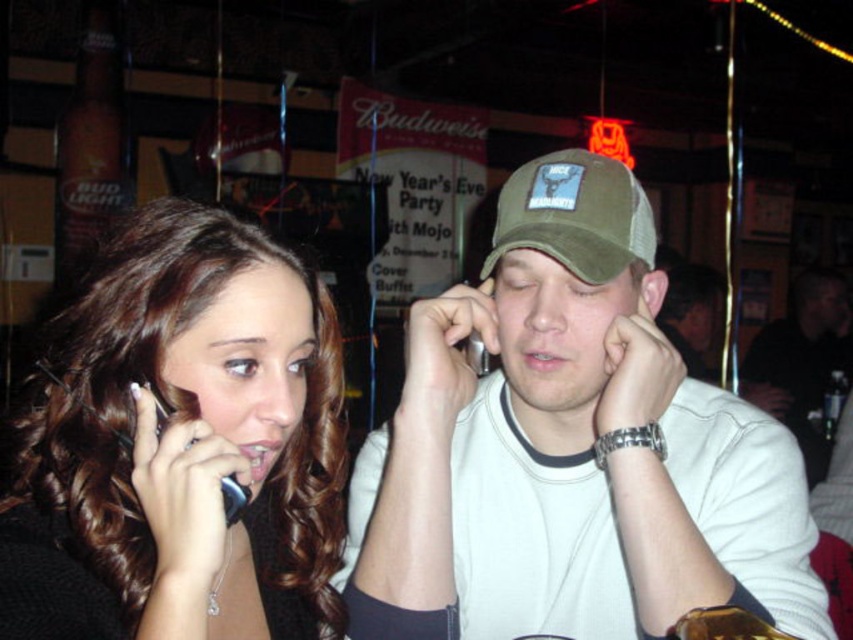
You are at a party and notice two people sitting together. They are both wearing hats. The hats are labeled as the khaki fabric cap at center and the olive green mesh baseball cap at center. Which hat is positioned lower on the person?

The khaki fabric cap at center is located below the olive green mesh baseball cap at center, so the khaki fabric cap at center is positioned lower on the person.